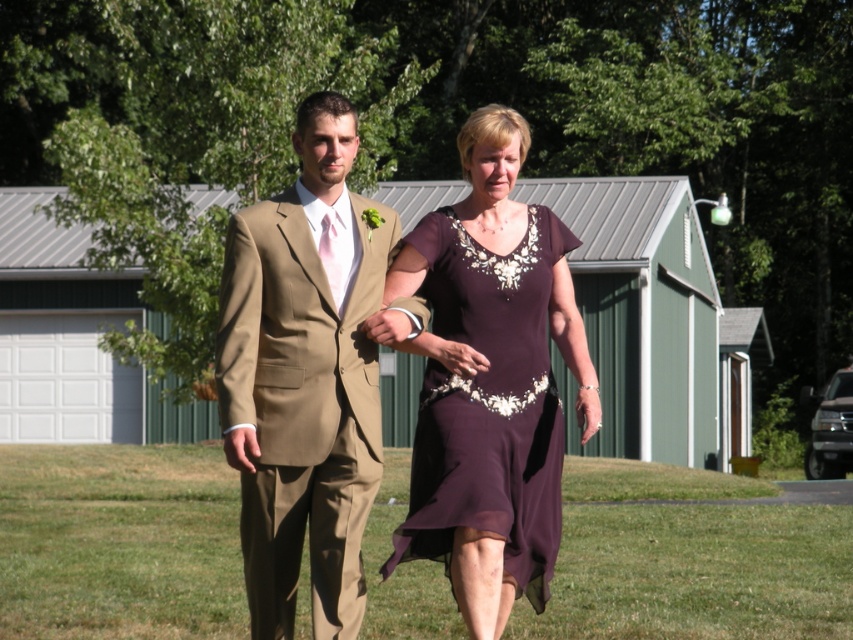
You are a photographer taking a picture of the matte khaki suit at center and the dark purple chiffon dress at center. Which one will appear larger in the photo?

The matte khaki suit at center will appear larger in the photo because it is closer to the viewer than the dark purple chiffon dress at center.

Consider the image. You are a photographer at a wedding venue and need to arrange the couple for a photo. The couple is currently standing with the matte khaki suit at center and the matte purple dress at center. To ensure proper framing, you need to know their relative positions. Which object is on the left side of the other?

The matte khaki suit at center is positioned on the left side of the matte purple dress at center.